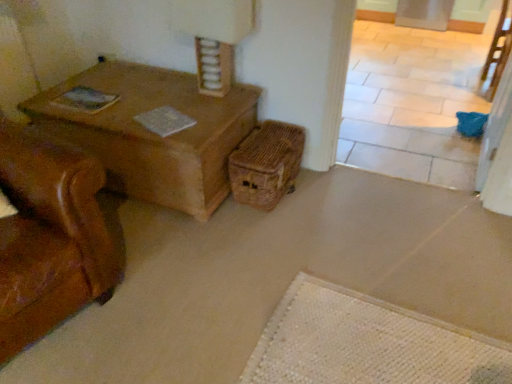
Identify the location of blank area to the left of brown woven chair at upper right. The image size is (512, 384). (454, 94).